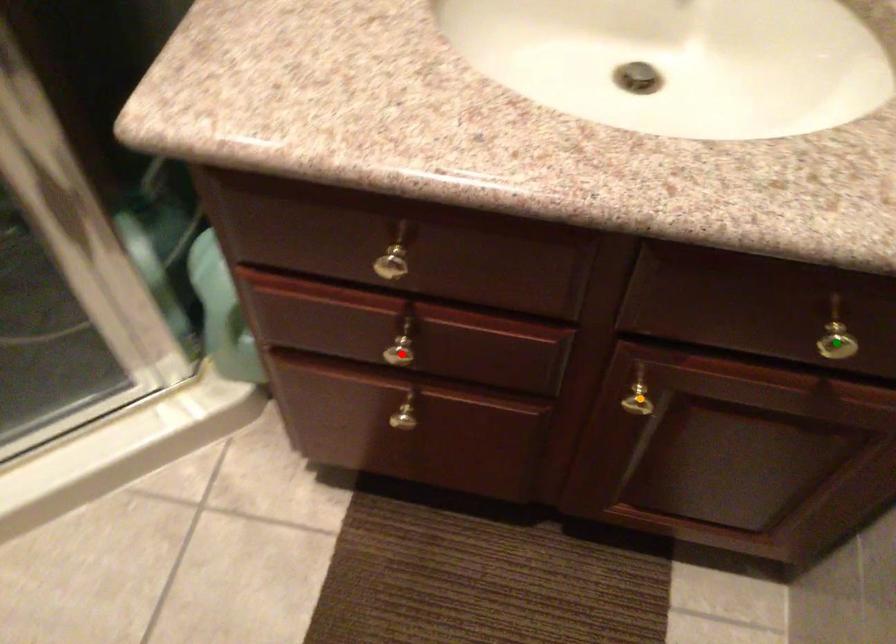
Order these from nearest to farthest:
1. red point
2. green point
3. orange point

green point < orange point < red point